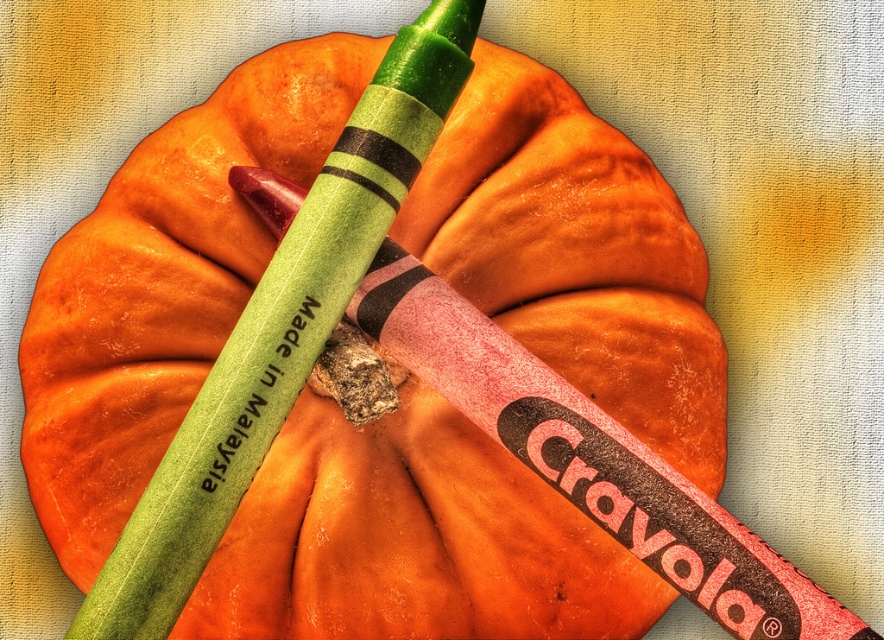
Is green matte crayon at upper center bigger than black matte text at center?

Yes.

Who is taller, green matte crayon at upper center or black matte text at center?

green matte crayon at upper center

Where is `green matte crayon at upper center`? Image resolution: width=884 pixels, height=640 pixels. green matte crayon at upper center is located at coordinates (282, 330).